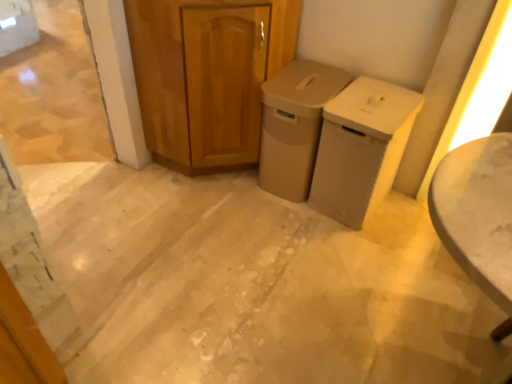
You are a GUI agent. You are given a task and a screenshot of the screen. Output one action in this format:
    pyautogui.click(x=<x>, y=<y>)
    Task: Click on the beige matte trash can at center, positioned as the 2th waste container in right-to-left order
    Image resolution: width=512 pixels, height=384 pixels.
    Given the screenshot: What is the action you would take?
    pyautogui.click(x=294, y=125)

Describe the element at coordinates (294, 125) in the screenshot. The width and height of the screenshot is (512, 384). I see `beige matte trash can at center, positioned as the 2th waste container in right-to-left order` at that location.

Where is `wooden cabinet at center`? The width and height of the screenshot is (512, 384). wooden cabinet at center is located at coordinates (207, 76).

Which object is positioned more to the right, beige textured waste bin at center-right, acting as the second waste container starting from the left, or wooden cabinet at center?

From the viewer's perspective, beige textured waste bin at center-right, acting as the second waste container starting from the left, appears more on the right side.

Who is smaller, beige textured waste bin at center-right, positioned as the first waste container in right-to-left order, or wooden cabinet at center?

Smaller between the two is beige textured waste bin at center-right, positioned as the first waste container in right-to-left order.

Between point (327, 183) and point (294, 14), which one is positioned behind?

The point (327, 183) is more distant.

From the image's perspective, between beige matte trash can at center, positioned as the 2th waste container in right-to-left order, and wooden cabinet at center, which one is located above?

From the image's view, wooden cabinet at center is above.

Considering the relative sizes of beige matte trash can at center, positioned as the first waste container in left-to-right order, and wooden cabinet at center in the image provided, is beige matte trash can at center, positioned as the first waste container in left-to-right order, thinner than wooden cabinet at center?

Correct, the width of beige matte trash can at center, positioned as the first waste container in left-to-right order, is less than that of wooden cabinet at center.

Which of these two, beige matte trash can at center, positioned as the first waste container in left-to-right order, or wooden cabinet at center, stands taller?

Standing taller between the two is wooden cabinet at center.

Can we say beige matte trash can at center, positioned as the first waste container in left-to-right order, lies outside beige textured waste bin at center-right, positioned as the first waste container in right-to-left order?

Yes, beige matte trash can at center, positioned as the first waste container in left-to-right order, is not within beige textured waste bin at center-right, positioned as the first waste container in right-to-left order.

Which object is further away from the camera taking this photo, beige matte trash can at center, positioned as the 2th waste container in right-to-left order, or beige textured waste bin at center-right, acting as the second waste container starting from the left?

beige matte trash can at center, positioned as the 2th waste container in right-to-left order, is behind.

Which of these two, beige matte trash can at center, positioned as the first waste container in left-to-right order, or beige textured waste bin at center-right, positioned as the first waste container in right-to-left order, stands shorter?

Standing shorter between the two is beige textured waste bin at center-right, positioned as the first waste container in right-to-left order.

Is beige matte trash can at center, positioned as the first waste container in left-to-right order, next to beige textured waste bin at center-right, acting as the second waste container starting from the left?

beige matte trash can at center, positioned as the first waste container in left-to-right order, and beige textured waste bin at center-right, acting as the second waste container starting from the left, are not in contact.

Is the surface of wooden cabinet at center in direct contact with beige matte trash can at center, positioned as the 2th waste container in right-to-left order?

No, wooden cabinet at center is not next to beige matte trash can at center, positioned as the 2th waste container in right-to-left order.

Is wooden cabinet at center completely or partially outside of beige matte trash can at center, positioned as the 2th waste container in right-to-left order?

Yes, wooden cabinet at center is outside of beige matte trash can at center, positioned as the 2th waste container in right-to-left order.

How many degrees apart are the facing directions of wooden cabinet at center and beige matte trash can at center, positioned as the first waste container in left-to-right order?

There is a 89.6-degree angle between the facing directions of wooden cabinet at center and beige matte trash can at center, positioned as the first waste container in left-to-right order.

How many degrees apart are the facing directions of beige textured waste bin at center-right, positioned as the first waste container in right-to-left order, and beige matte trash can at center, positioned as the 2th waste container in right-to-left order?

beige textured waste bin at center-right, positioned as the first waste container in right-to-left order, and beige matte trash can at center, positioned as the 2th waste container in right-to-left order, are facing 0.414 degrees away from each other.

Is point (393, 107) farther from viewer compared to point (302, 99)?

That is False.

From a real-world perspective, which object rests below the other?

beige textured waste bin at center-right, acting as the second waste container starting from the left, from a real-world perspective.

At what (x,y) coordinates should I click in order to perform the action: click on waste container located on the right of beige matte trash can at center, positioned as the first waste container in left-to-right order. Please return your answer as a coordinate pair (x, y). Looking at the image, I should click on (361, 148).

Is wooden cabinet at center inside the boundaries of beige textured waste bin at center-right, acting as the second waste container starting from the left, or outside?

wooden cabinet at center is outside beige textured waste bin at center-right, acting as the second waste container starting from the left.

From a real-world perspective, between wooden cabinet at center and beige textured waste bin at center-right, acting as the second waste container starting from the left, who is vertically lower?

beige textured waste bin at center-right, acting as the second waste container starting from the left.

Considering their positions, is wooden cabinet at center located in front of or behind beige textured waste bin at center-right, positioned as the first waste container in right-to-left order?

wooden cabinet at center is positioned closer to the viewer than beige textured waste bin at center-right, positioned as the first waste container in right-to-left order.

In the image, is wooden cabinet at center on the left side or the right side of beige textured waste bin at center-right, positioned as the first waste container in right-to-left order?

Clearly, wooden cabinet at center is on the left of beige textured waste bin at center-right, positioned as the first waste container in right-to-left order, in the image.

From a real-world perspective, count 2nd waste containers downward from the wooden cabinet at center and point to it. Please provide its 2D coordinates.

[(361, 148)]

The height and width of the screenshot is (384, 512). In order to click on cabinetry that appears in front of the beige matte trash can at center, positioned as the first waste container in left-to-right order in this screenshot , I will do `click(207, 76)`.

From the image, which object appears to be nearer to beige matte trash can at center, positioned as the first waste container in left-to-right order, wooden cabinet at center or beige textured waste bin at center-right, acting as the second waste container starting from the left?

beige textured waste bin at center-right, acting as the second waste container starting from the left, lies closer to beige matte trash can at center, positioned as the first waste container in left-to-right order, than the other object.

From the image, which object appears to be farther from wooden cabinet at center, beige matte trash can at center, positioned as the first waste container in left-to-right order, or beige textured waste bin at center-right, acting as the second waste container starting from the left?

beige textured waste bin at center-right, acting as the second waste container starting from the left, is positioned further to the anchor wooden cabinet at center.

From the image, which object appears to be nearer to wooden cabinet at center, beige textured waste bin at center-right, acting as the second waste container starting from the left, or beige matte trash can at center, positioned as the 2th waste container in right-to-left order?

Among the two, beige matte trash can at center, positioned as the 2th waste container in right-to-left order, is located nearer to wooden cabinet at center.

Estimate the real-world distances between objects in this image. Which object is closer to beige matte trash can at center, positioned as the first waste container in left-to-right order, beige textured waste bin at center-right, acting as the second waste container starting from the left, or wooden cabinet at center?

Among the two, beige textured waste bin at center-right, acting as the second waste container starting from the left, is located nearer to beige matte trash can at center, positioned as the first waste container in left-to-right order.

From the picture: When comparing their distances from beige textured waste bin at center-right, positioned as the first waste container in right-to-left order, does wooden cabinet at center or beige matte trash can at center, positioned as the first waste container in left-to-right order, seem closer?

beige matte trash can at center, positioned as the first waste container in left-to-right order, is closer to beige textured waste bin at center-right, positioned as the first waste container in right-to-left order.

Estimate the real-world distances between objects in this image. Which object is further from beige textured waste bin at center-right, acting as the second waste container starting from the left, beige matte trash can at center, positioned as the 2th waste container in right-to-left order, or wooden cabinet at center?

wooden cabinet at center is further to beige textured waste bin at center-right, acting as the second waste container starting from the left.

Locate an element on the screen. Image resolution: width=512 pixels, height=384 pixels. waste container between wooden cabinet at center and beige textured waste bin at center-right, acting as the second waste container starting from the left, from left to right is located at coordinates 294,125.